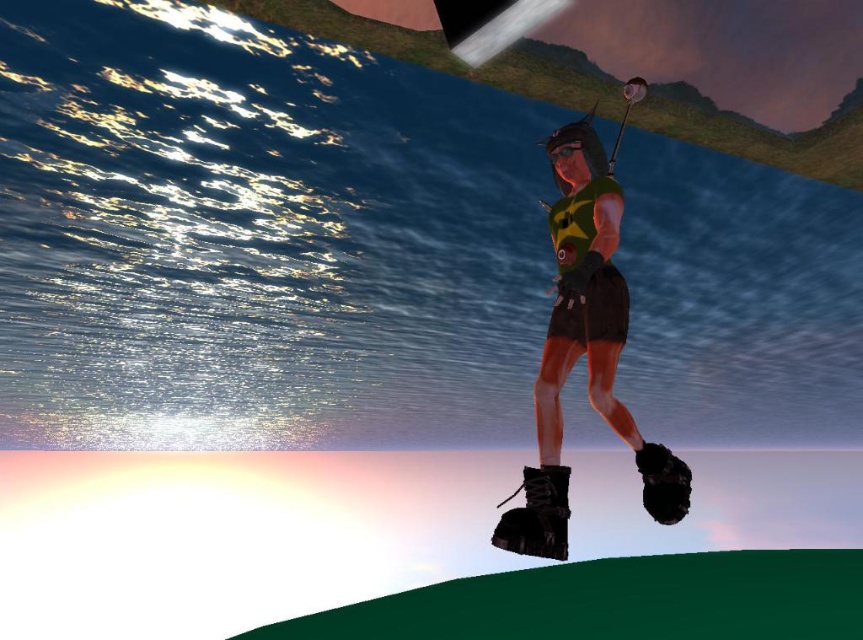
Can you confirm if shiny black boots at center is smaller than black leather baseball glove at lower right?

No, shiny black boots at center is not smaller than black leather baseball glove at lower right.

Does shiny black boots at center appear over black leather baseball glove at lower right?

Correct, shiny black boots at center is located above black leather baseball glove at lower right.

Image resolution: width=863 pixels, height=640 pixels. What do you see at coordinates (584, 349) in the screenshot?
I see `shiny black boots at center` at bounding box center [584, 349].

I want to click on shiny black boots at center, so click(x=584, y=349).